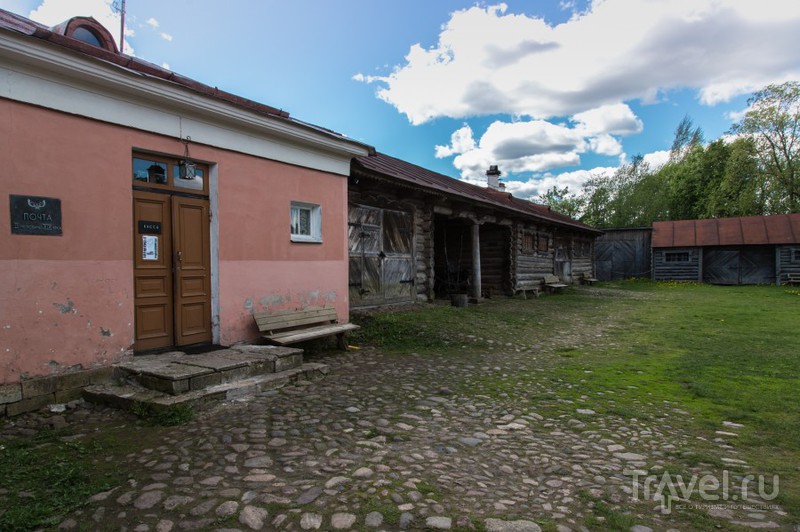
Locate an element on the screen. door is located at coordinates (192, 246).